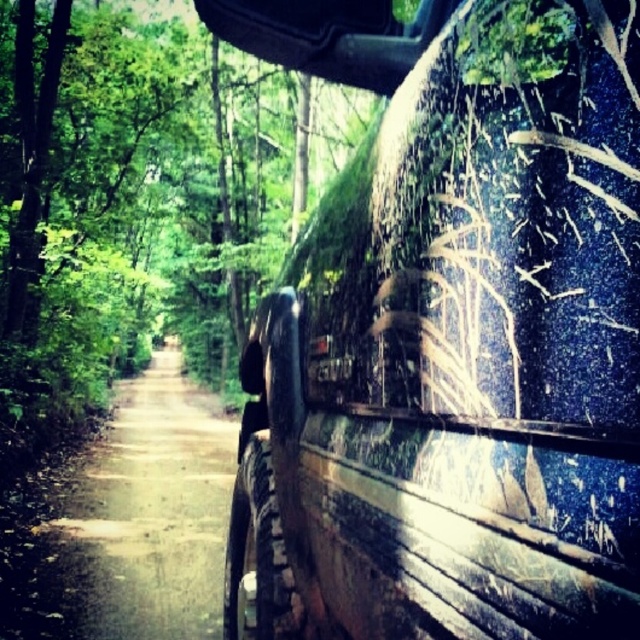
You are a driver trying to navigate through the forest trail. You notice the muddy rubber tire at right and the dirt road at center. Which object is positioned higher in the scene?

The muddy rubber tire at right is much taller than the dirt road at center, so it is positioned higher in the scene.

From the picture: You are a hiker trying to navigate through the forest. You see the muddy rubber tire at right and the dirt road at center. Which object is directly on top of the other?

The muddy rubber tire at right is positioned over the dirt road at center.